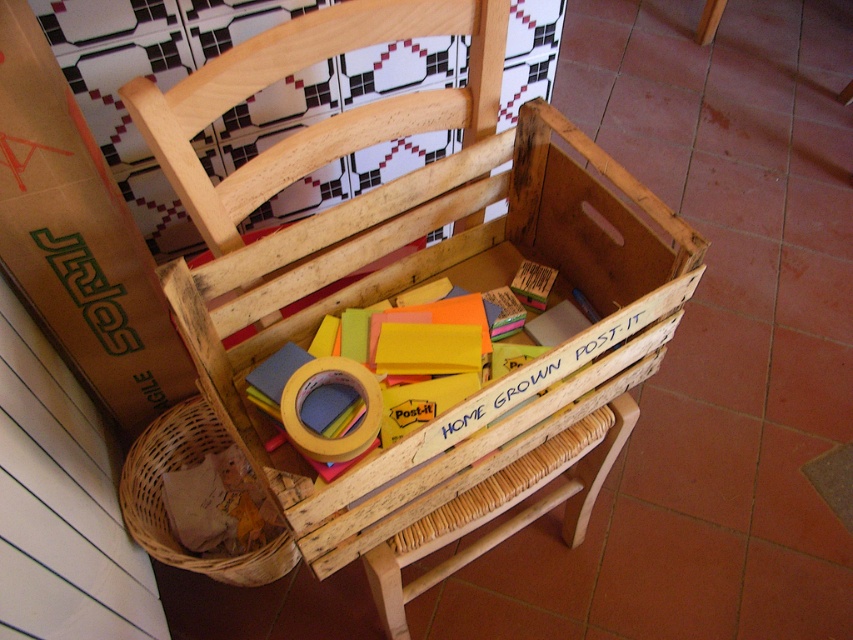
Between wooden crate at center and woven brown basket at lower left, which one is positioned higher?

wooden crate at center

Find the location of a particular element. This screenshot has width=853, height=640. wooden crate at center is located at coordinates (480, 288).

Is point (637, 348) positioned in front of point (161, 540)?

Yes, it is in front of point (161, 540).

The image size is (853, 640). I want to click on wooden crate at center, so click(480, 288).